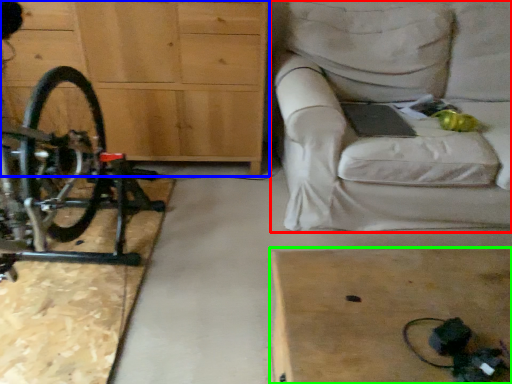
Question: Estimate the real-world distances between objects in this image. Which object is farther from studio couch (highlighted by a red box), chest of drawers (highlighted by a blue box) or table (highlighted by a green box)?

Choices:
 (A) chest of drawers
 (B) table

Answer: (B)